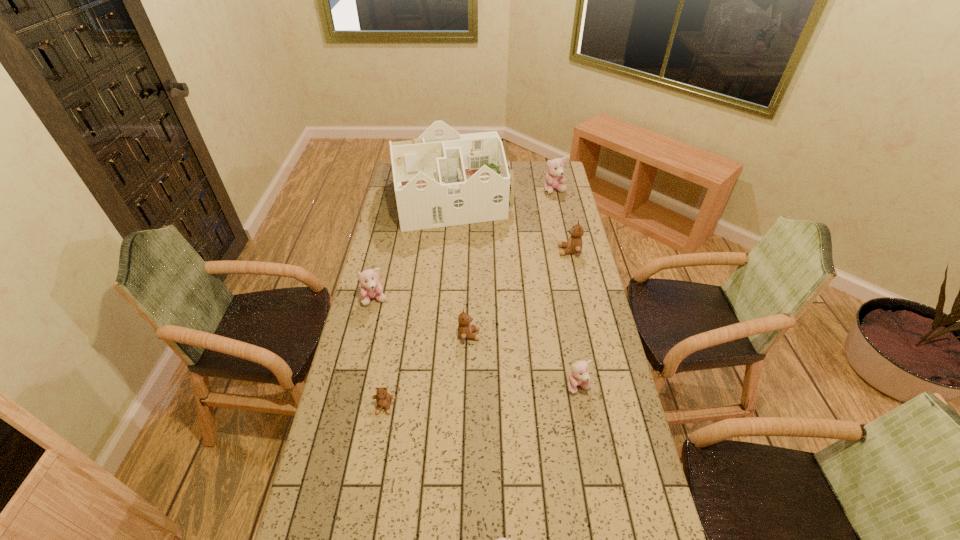
This screenshot has height=540, width=960. Find the location of `free space that is in between the seventh shortest object and the second farthest teddy bear`. free space that is in between the seventh shortest object and the second farthest teddy bear is located at coordinates (562, 221).

Find the location of a particular element. The width and height of the screenshot is (960, 540). vacant space that is in between the third nearest pink teddy bear and the white dollhouse is located at coordinates (414, 249).

Where is `unoccupied position between the second brown teddy bear from left to right and the white dollhouse`? unoccupied position between the second brown teddy bear from left to right and the white dollhouse is located at coordinates (461, 267).

Identify which object is located as the third nearest to the tallest object. Please provide its 2D coordinates. Your answer should be formatted as a tuple, i.e. [(x, y)], where the tuple contains the x and y coordinates of a point satisfying the conditions above.

[(371, 288)]

Locate which object is the sixth closest to the smallest brown teddy bear. Please provide its 2D coordinates. Your answer should be formatted as a tuple, i.e. [(x, y)], where the tuple contains the x and y coordinates of a point satisfying the conditions above.

[(574, 245)]

Identify which teddy bear is the closest to the fifth nearest object. Please provide its 2D coordinates. Your answer should be formatted as a tuple, i.e. [(x, y)], where the tuple contains the x and y coordinates of a point satisfying the conditions above.

[(465, 330)]

You are a GUI agent. You are given a task and a screenshot of the screen. Output one action in this format:
    pyautogui.click(x=<x>, y=<y>)
    Task: Click on the teddy bear that is the fifth closest to the second pink teddy bear from left to right
    
    Given the screenshot: What is the action you would take?
    pyautogui.click(x=574, y=245)

Choose which pink teddy bear is the third nearest neighbor to the dollhouse. Please provide its 2D coordinates. Your answer should be formatted as a tuple, i.e. [(x, y)], where the tuple contains the x and y coordinates of a point satisfying the conditions above.

[(579, 376)]

Locate which pink teddy bear is the third closest to the third farthest pink teddy bear. Please provide its 2D coordinates. Your answer should be formatted as a tuple, i.e. [(x, y)], where the tuple contains the x and y coordinates of a point satisfying the conditions above.

[(554, 177)]

Identify the location of brown teddy bear identified as the closest to the second teddy bear from left to right. (465, 330).